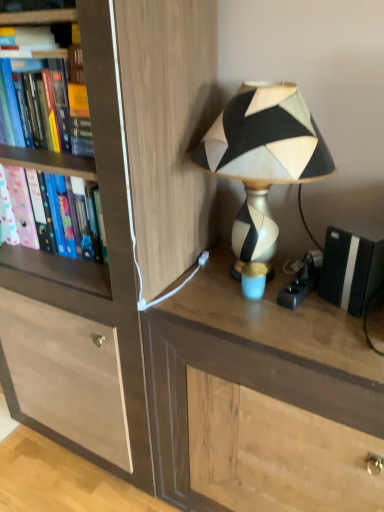
Where is `free area in between black and white geometric lampshade at upper right and black matte speaker at right`? free area in between black and white geometric lampshade at upper right and black matte speaker at right is located at coordinates (326, 318).